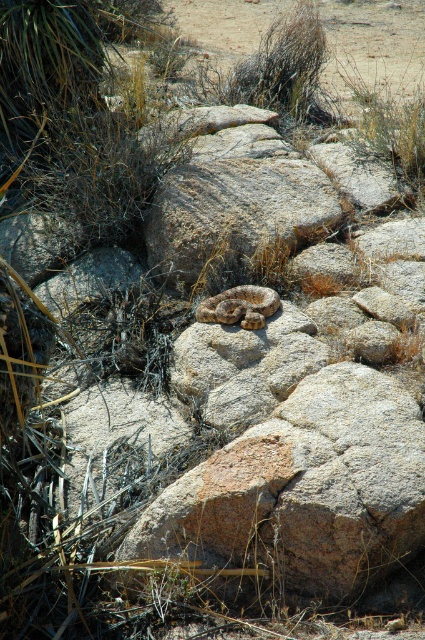
Between rusty stone boulder at center and brown scaly snake at center, which one is positioned higher?

rusty stone boulder at center is higher up.

Who is more forward, (193, 234) or (269, 291)?

Point (269, 291)

This screenshot has height=640, width=425. Find the location of `rusty stone boulder at center`. rusty stone boulder at center is located at coordinates (235, 209).